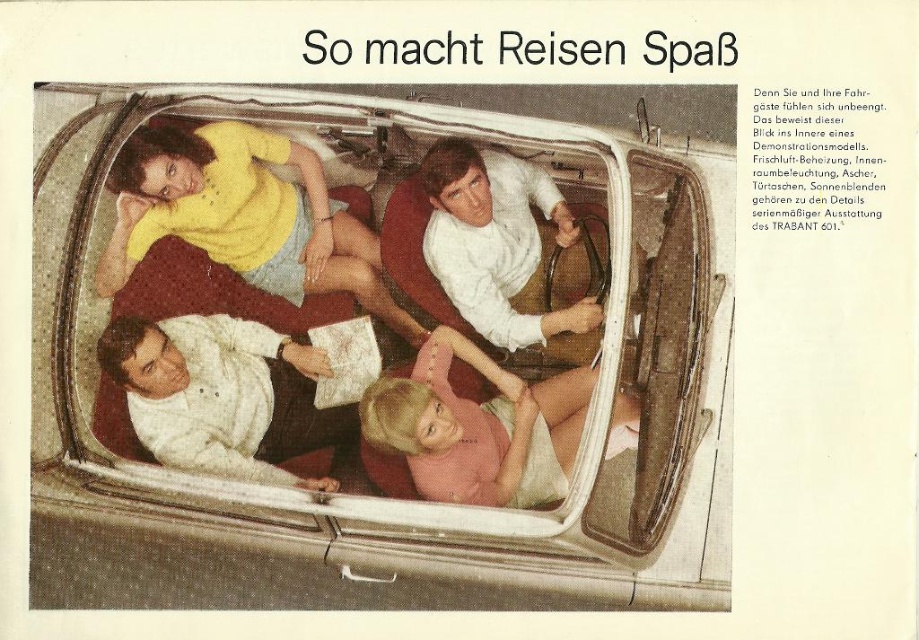
You are a passenger in the car and want to hand a document to the driver. The document is currently on the yellow fabric shirt at upper left. Which direction should you move it to reach the white smooth shirt at center?

The yellow fabric shirt at upper left is located below the white smooth shirt at center, so you should move the document upward to reach the white smooth shirt at center.

You are a passenger in the car and want to locate the yellow fabric shirt at upper left. According to the coordinates provided, where exactly would you find it?

The yellow fabric shirt at upper left is located at point (244, 216).